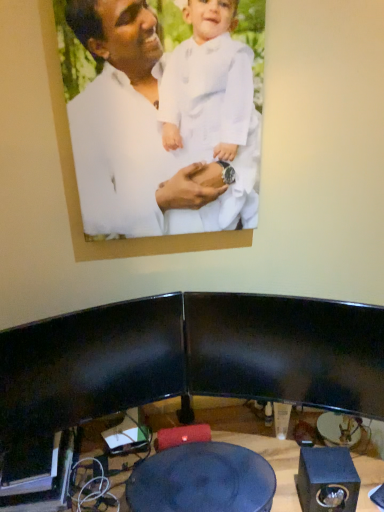
Question: From a real-world perspective, relative to white matte picture frame at upper center, is black matte speaker at lower right vertically above or below?

Choices:
 (A) below
 (B) above

Answer: (A)

Question: From the image's perspective, is black matte speaker at lower right located above or below white matte picture frame at upper center?

Choices:
 (A) below
 (B) above

Answer: (A)

Question: Which of these objects is positioned farthest from the black matte speaker at lower right?

Choices:
 (A) blue glossy table at center
 (B) white matte picture frame at upper center

Answer: (B)

Question: Estimate the real-world distances between objects in this image. Which object is farther from the black matte speaker at lower right?

Choices:
 (A) white matte picture frame at upper center
 (B) blue glossy table at center

Answer: (A)